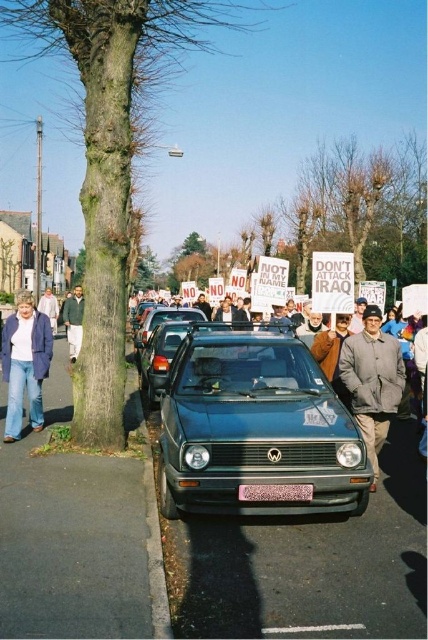
You are a pedestrian standing on the sidewalk and see the dark green jacket at center and the bare branches tree at upper center. Which object is higher in the image?

The bare branches tree at upper center is higher in the image than the dark green jacket at center.

You are a photographer trying to capture a photo of the dark green jacket at center. However, the bare branches tree at upper center is blocking your view. Can you adjust your position to avoid the tree blocking the jacket?

The bare branches tree at upper center is much taller than the dark green jacket at center, so if you lower your camera angle or move closer to the ground level, you can position yourself so that the tree is above the jacket and not blocking it.